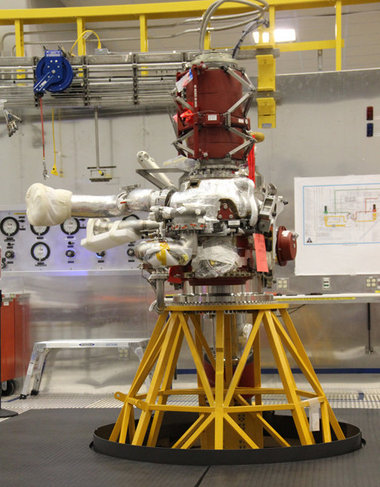
Find the location of a particular element. red cabinet on left center side is located at coordinates [x=14, y=360], [x=15, y=331].